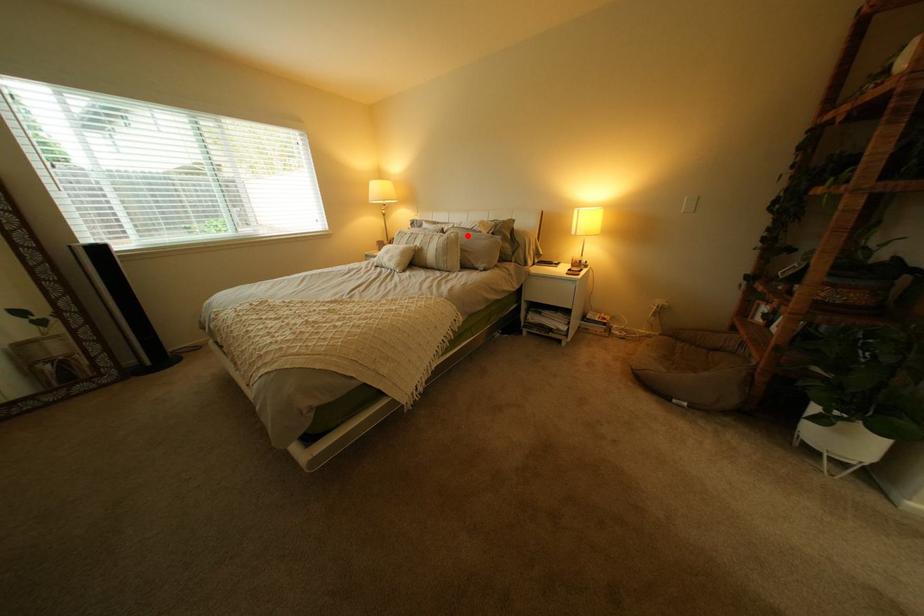
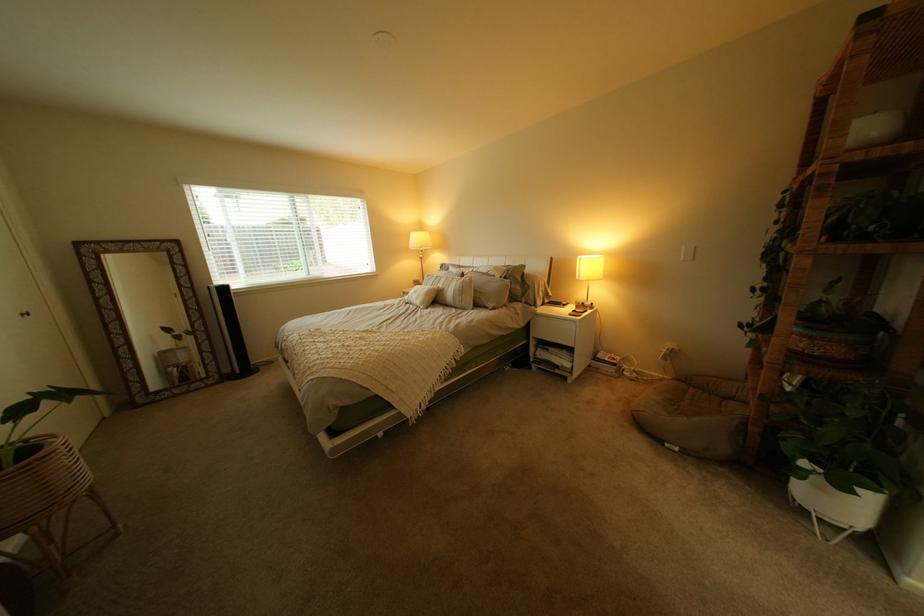
Where in the second image is the point corresponding to the highlighted location from the first image?

(482, 280)